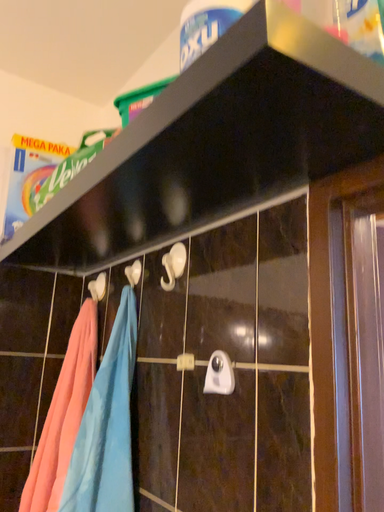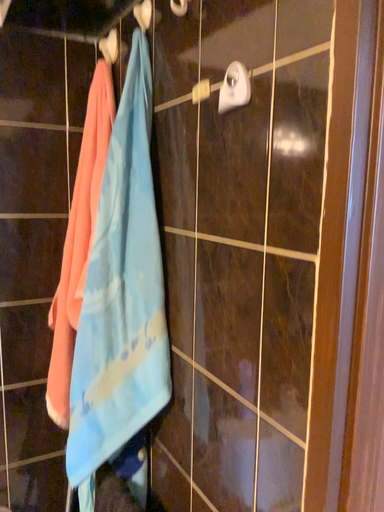
Question: How did the camera likely rotate when shooting the video?

Choices:
 (A) rotated downward
 (B) rotated upward

Answer: (A)